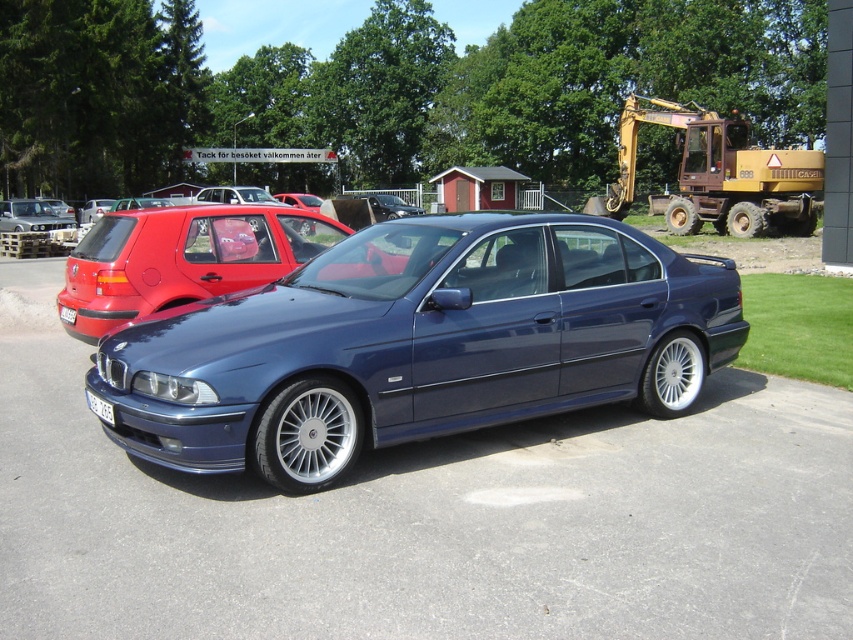
You are a delivery driver who needs to park your van between the metallic blue sedan at center and the yellow metallic excavator at upper right. Can you park your van there if your van is 2 meters wide?

The metallic blue sedan at center is closer to the viewer than the yellow metallic excavator at upper right, but the distance between them isn not specified. Without knowing the exact space available, it is impossible to determine if the van can fit.

You are a delivery driver who needs to park your truck in this area. The metallic blue sedan at center and the yellow metallic excavator at upper right are already present. Which vehicle should you avoid parking near to ensure enough space for maneuvering?

You should avoid parking near the yellow metallic excavator at upper right because it occupies more space than the metallic blue sedan at center, leaving less room for maneuvering.